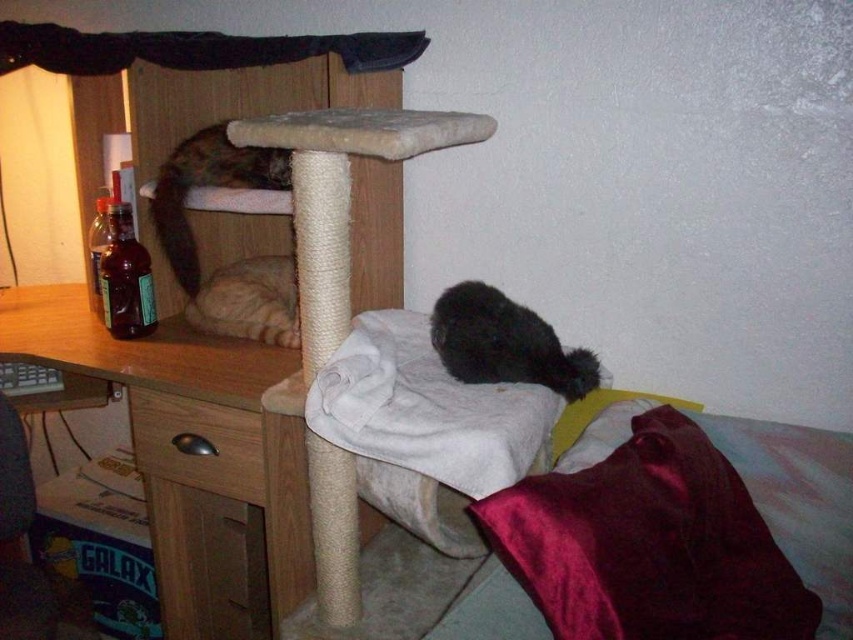
Question: Where is beige carpeted cat tree at center located in relation to striped fur cat at center in the image?

Choices:
 (A) below
 (B) above

Answer: (A)

Question: Considering the real-world distances, which object is closest to the tabby fur cat at upper left?

Choices:
 (A) beige carpeted cat tree at center
 (B) striped fur cat at center
 (C) wooden desk at left

Answer: (B)

Question: Is beige carpeted cat tree at center to the left of wooden desk at left from the viewer's perspective?

Choices:
 (A) no
 (B) yes

Answer: (A)

Question: Which point is farther to the camera?

Choices:
 (A) (318, 145)
 (B) (192, 435)
 (C) (231, 272)
 (D) (209, 172)

Answer: (C)

Question: Which object is farther from the camera taking this photo?

Choices:
 (A) wooden drawer at lower left
 (B) striped fur cat at center

Answer: (B)

Question: Is beige carpeted cat tree at center in front of wooden desk at left?

Choices:
 (A) no
 (B) yes

Answer: (B)